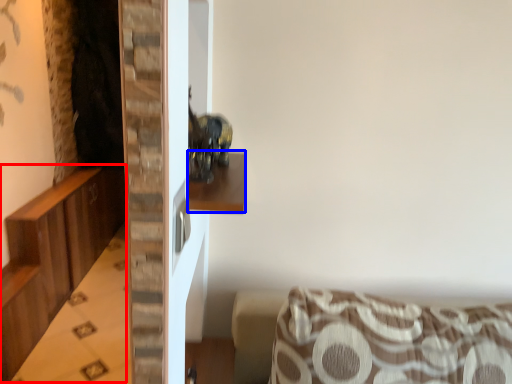
Question: Which object is closer to the camera taking this photo, dresser (highlighted by a red box) or shelf (highlighted by a blue box)?

Choices:
 (A) dresser
 (B) shelf

Answer: (B)